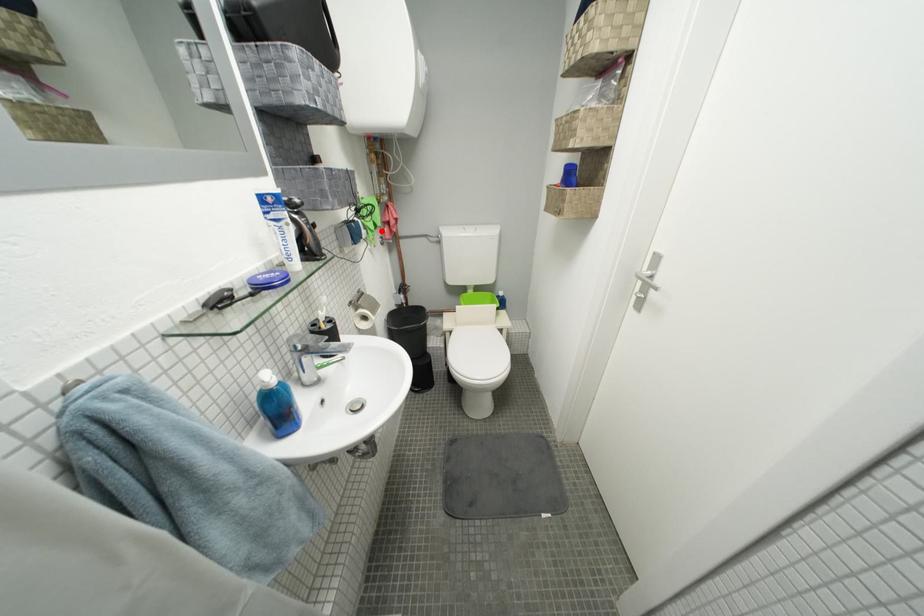
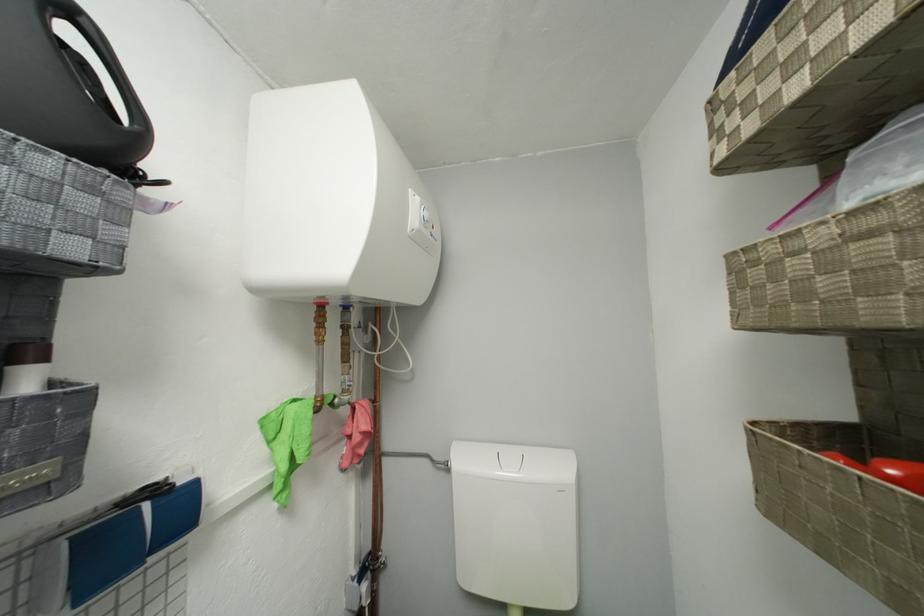
Where in the second image is the point corresponding to the highlighted location from the first image?

(293, 469)